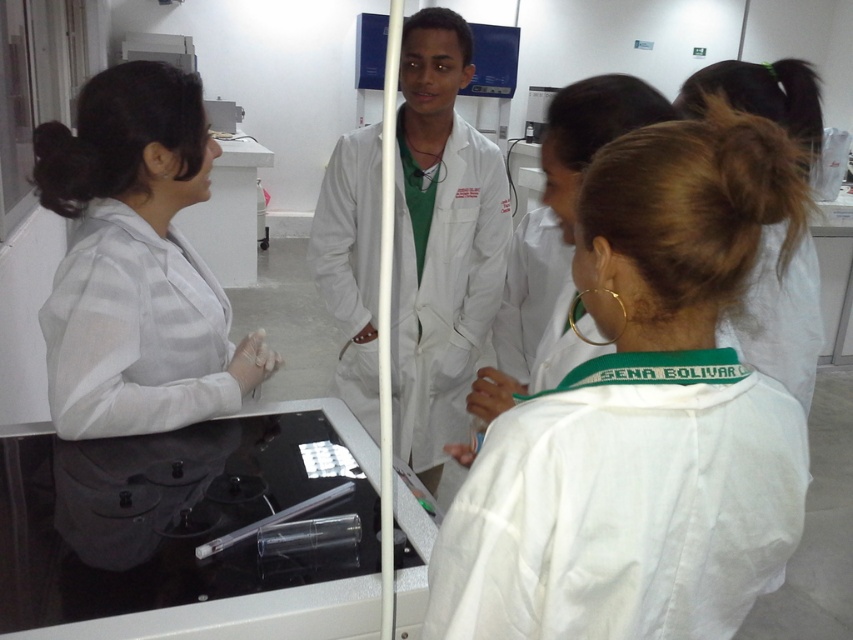
Based on the photo, is white fabric shirt at left wider than white lab coat at center?

Incorrect, white fabric shirt at left's width does not surpass white lab coat at center's.

Does white fabric shirt at left have a larger size compared to white lab coat at center?

No.

Which is in front, point (111, 81) or point (412, 38)?

Point (111, 81)

Identify the location of white fabric shirt at left. (136, 262).

Is white matte lab coat at center above black glass tray at lower left?

Correct, white matte lab coat at center is located above black glass tray at lower left.

Locate an element on the screen. The height and width of the screenshot is (640, 853). white matte lab coat at center is located at coordinates click(x=642, y=417).

Does black glass tray at lower left have a smaller size compared to white lab coat at center?

Yes, black glass tray at lower left is smaller than white lab coat at center.

Is black glass tray at lower left behind white lab coat at center?

No, it is in front of white lab coat at center.

Identify the location of black glass tray at lower left. The height and width of the screenshot is (640, 853). (186, 531).